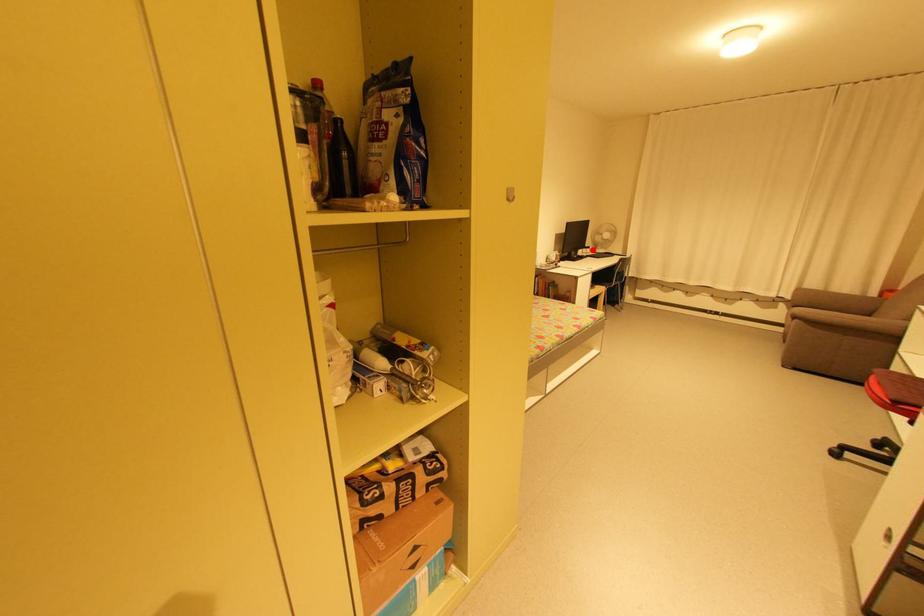
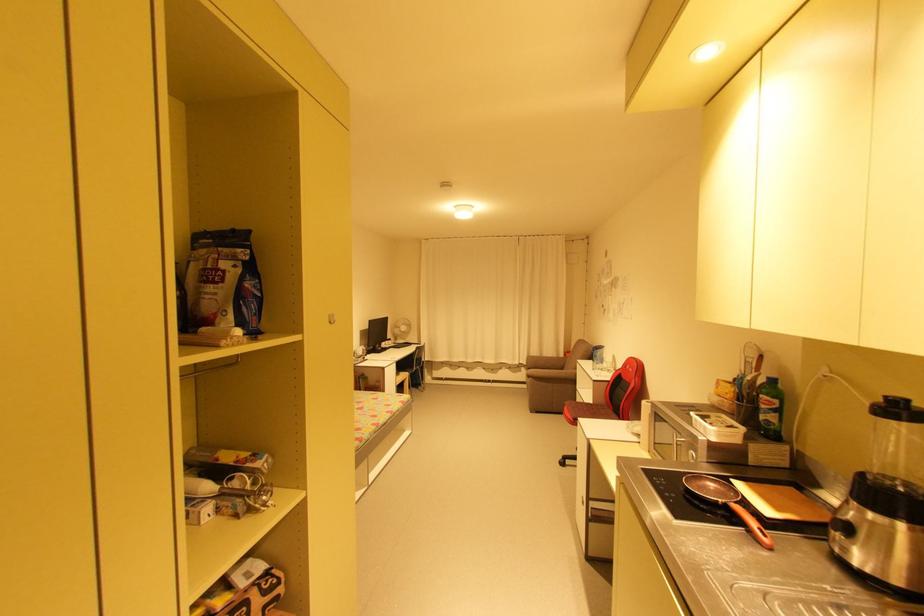
The point at the highlighted location is marked in the first image. Where is the corresponding point in the second image?

(395, 342)